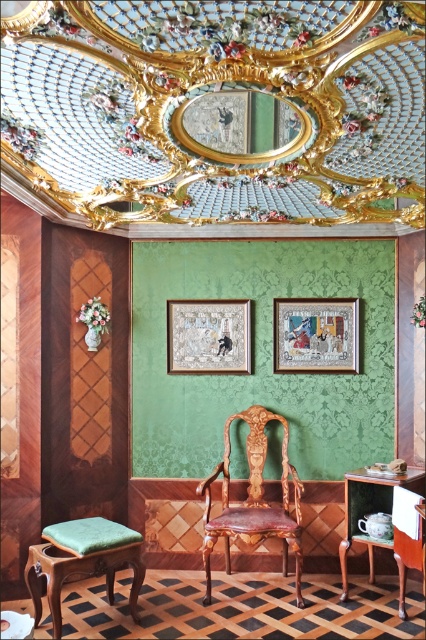
Does green velvet stool at lower left appear on the left side of matte gold picture frame at center?

Indeed, green velvet stool at lower left is positioned on the left side of matte gold picture frame at center.

Can you confirm if green velvet stool at lower left is positioned to the right of matte gold picture frame at center?

Incorrect, green velvet stool at lower left is not on the right side of matte gold picture frame at center.

Between point (77, 572) and point (282, 317), which one is positioned in front?

Point (77, 572) is in front.

I want to click on green velvet stool at lower left, so click(x=81, y=561).

Consider the image. Who is more distant from viewer, (299, 508) or (406, 481)?

The point (299, 508) is behind.

In the scene shown: Can you confirm if polished wood armchair at center is positioned to the right of porcelain teacup at lower right?

Incorrect, polished wood armchair at center is not on the right side of porcelain teacup at lower right.

Describe the element at coordinates (253, 499) in the screenshot. I see `polished wood armchair at center` at that location.

Locate an element on the screen. polished wood armchair at center is located at coordinates (253, 499).

Between wooden framed picture at center and porcelain teacup at lower right, which one appears on the right side from the viewer's perspective?

From the viewer's perspective, porcelain teacup at lower right appears more on the right side.

Does wooden framed picture at center have a smaller size compared to porcelain teacup at lower right?

Correct, wooden framed picture at center occupies less space than porcelain teacup at lower right.

Identify the location of wooden framed picture at center. (207, 337).

Locate an element on the screen. The image size is (426, 640). wooden framed picture at center is located at coordinates (207, 337).